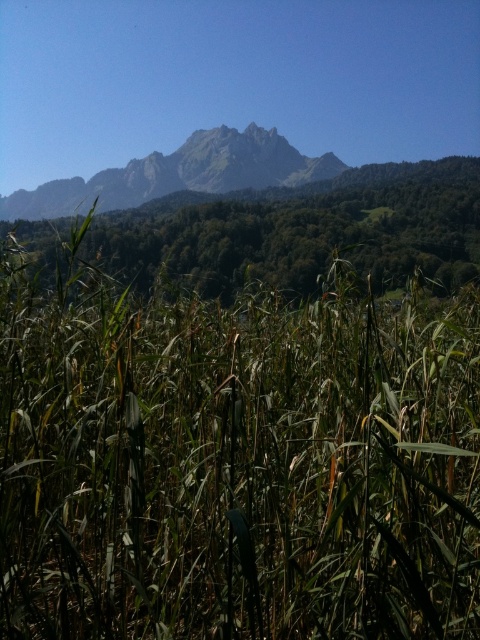
You are a hiker who wants to take a photo of the rugged granite mountain range at upper center from the green grass at center. Considering the distance between them is 9.81 feet, can you capture the entire mountain range in your smartphone camera without moving your position?

The distance between the green grass at center and the rugged granite mountain range at upper center is 9.81 feet. Since smartphones typically have wide angle lenses, you can likely capture the entire rugged granite mountain range at upper center from the green grass at center without moving your position.

You are standing in the serene natural landscape and want to walk from the point closer to you to the point further away. Which path should you take between the two points, point [300,582] and point [172,241]?

You should walk from point [300,582] to point [172,241] because point [300,582] is closer to the viewer and the other point is further away.